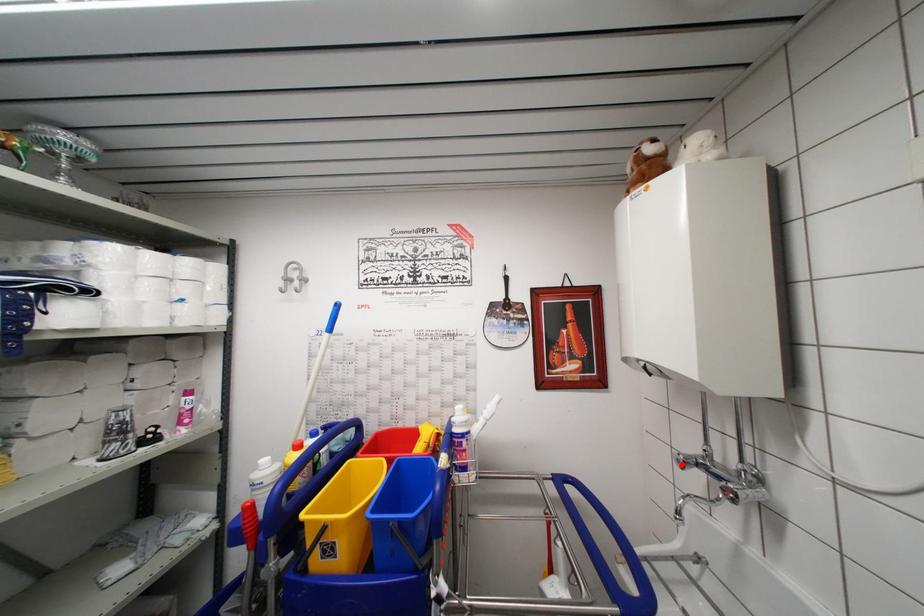
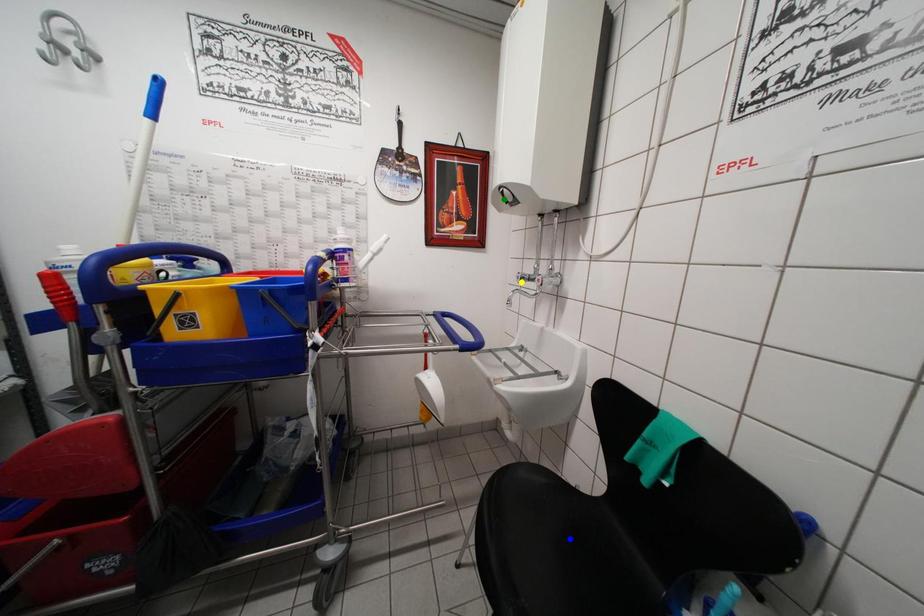
Question: I am providing you with two images of the same scene from different viewpoints. A red point is marked on the first image. You are given multiple points on the second image. Can you choose the point in image 2 that corresponds to the point in image 1?

Choices:
 (A) blue point
 (B) yellow point
 (C) green point

Answer: (B)